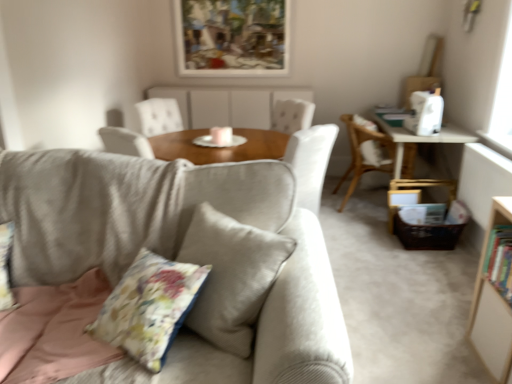
Question: In terms of width, does white wood bookcase at right look wider or thinner when compared to matte wood table at center?

Choices:
 (A) thin
 (B) wide

Answer: (A)

Question: From a real-world perspective, relative to matte wood table at center, is white wood bookcase at right vertically above or below?

Choices:
 (A) below
 (B) above

Answer: (A)

Question: Estimate the real-world distances between objects in this image. Which object is farther from the wooden picture frame at upper center?

Choices:
 (A) wooden chair at right
 (B) hardcover book at right
 (C) wooden table at right
 (D) light gray fabric couch at center
 (E) white wood bookcase at right

Answer: (B)

Question: Which of these objects is positioned closest to the floral fabric pillow at center?

Choices:
 (A) wooden table at right
 (B) matte wood table at center
 (C) light gray fabric couch at center
 (D) white wood bookcase at right
 (E) wooden picture frame at upper center

Answer: (C)